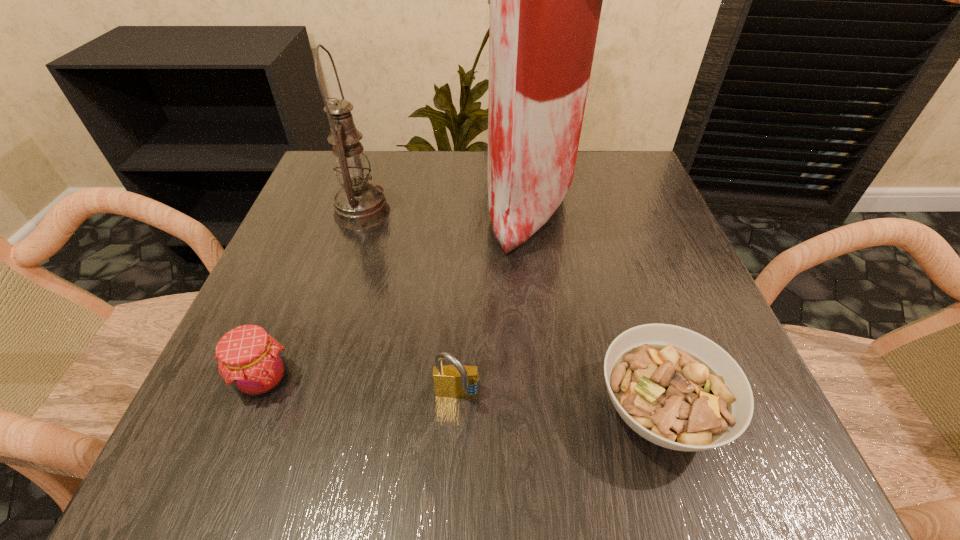
Where is `grocery bag`? This screenshot has width=960, height=540. grocery bag is located at coordinates (545, 0).

In order to click on oil lamp in this screenshot , I will do `click(359, 205)`.

At what (x,y) coordinates should I click in order to perform the action: click on the third tallest object. Please return your answer as a coordinate pair (x, y). Looking at the image, I should click on (455, 381).

The height and width of the screenshot is (540, 960). I want to click on jam, so click(x=250, y=360).

In order to click on stew in this screenshot , I will do [676, 388].

This screenshot has width=960, height=540. What are the coordinates of `vacant space located on the front of the tallest object` in the screenshot? It's located at (562, 441).

You are a GUI agent. You are given a task and a screenshot of the screen. Output one action in this format:
    pyautogui.click(x=<x>, y=<y>)
    Task: Click on the free space located 0.260m on the right of the second tallest object
    
    Given the screenshot: What is the action you would take?
    pyautogui.click(x=512, y=212)

Identify the location of free location located 0.090m on the side with the combination dials of the padlock. The height and width of the screenshot is (540, 960). [x=454, y=477].

Image resolution: width=960 pixels, height=540 pixels. I want to click on vacant area situated on the back of the jam, so click(300, 290).

Find the location of a particular element. vacant space located on the back of the stew is located at coordinates (607, 242).